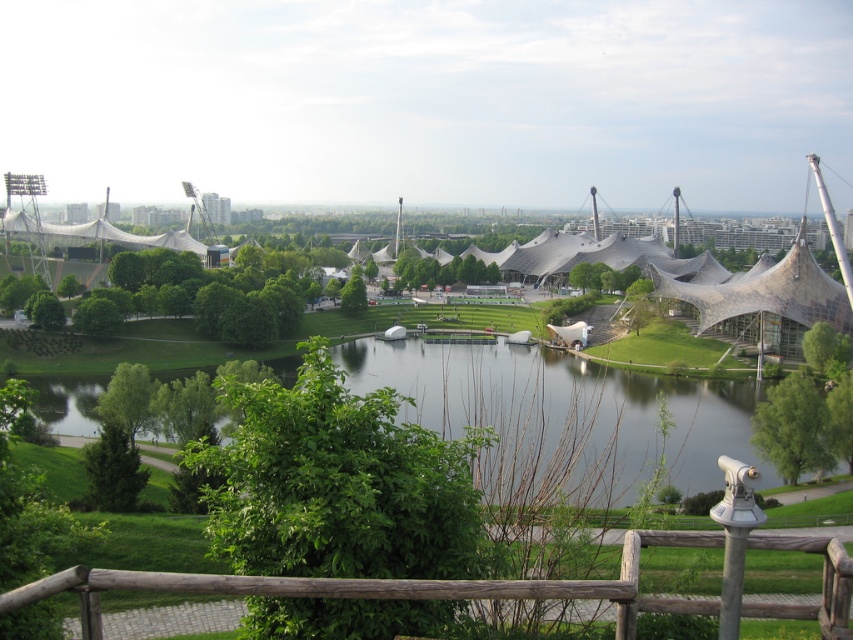
You are standing at the edge of the brown wooden rail at lower center and want to walk towards the green grassy river at center. Which direction should you move to reach it?

The green grassy river at center is positioned on the left side of the brown wooden rail at lower center, so you should move to the left to reach it.

You are a park visitor holding a 1.2 meter wide picnic blanket. You want to place it between the textured fabric dome at center and the brown wooden rail at lower center. Can the space between them accommodate your blanket?

The textured fabric dome at center is wider than the brown wooden rail at lower center. However, the exact distance between them isn not specified. Without knowing the actual space between the two objects, it is impossible to determine if the 1.2 meter wide picnic blanket will fit.